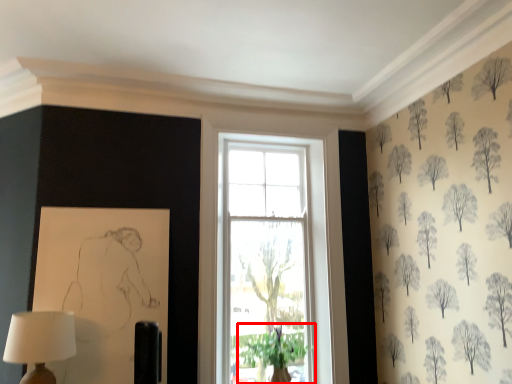
Question: Where is plant (annotated by the red box) located in relation to table lamp in the image?

Choices:
 (A) left
 (B) right

Answer: (B)